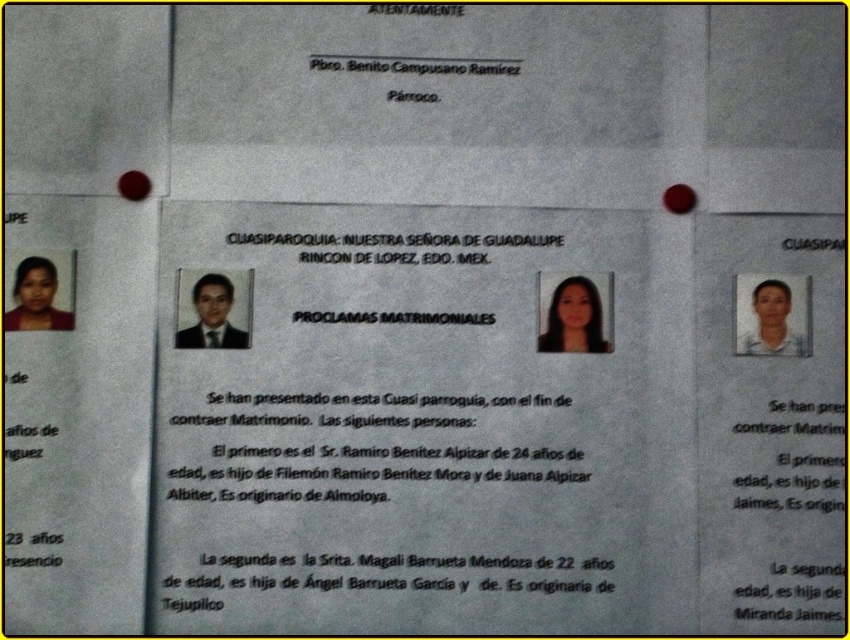
Question: Can you confirm if matte white photo at right is smaller than whitepapertext at right?

Choices:
 (A) yes
 (B) no

Answer: (B)

Question: Does black paper text at center come behind matte black portrait at left?

Choices:
 (A) no
 (B) yes

Answer: (A)

Question: Considering the real-world distances, which object is closest to the matte black portrait at left?

Choices:
 (A) black paper text at center
 (B) matte white photo at right
 (C) black paper at center
 (D) smooth black hair at center

Answer: (C)

Question: Among these objects, which one is farthest from the camera?

Choices:
 (A) black paper text at center
 (B) matte black portrait at left
 (C) matte white photo at right
 (D) whitepapertext at right

Answer: (D)

Question: Which of the following is the farthest from the observer?

Choices:
 (A) pyautogui.click(x=842, y=243)
 (B) pyautogui.click(x=468, y=241)
 (C) pyautogui.click(x=561, y=330)
 (D) pyautogui.click(x=26, y=301)

Answer: (A)

Question: Does black paper text at center lie in front of black paper at center?

Choices:
 (A) no
 (B) yes

Answer: (B)